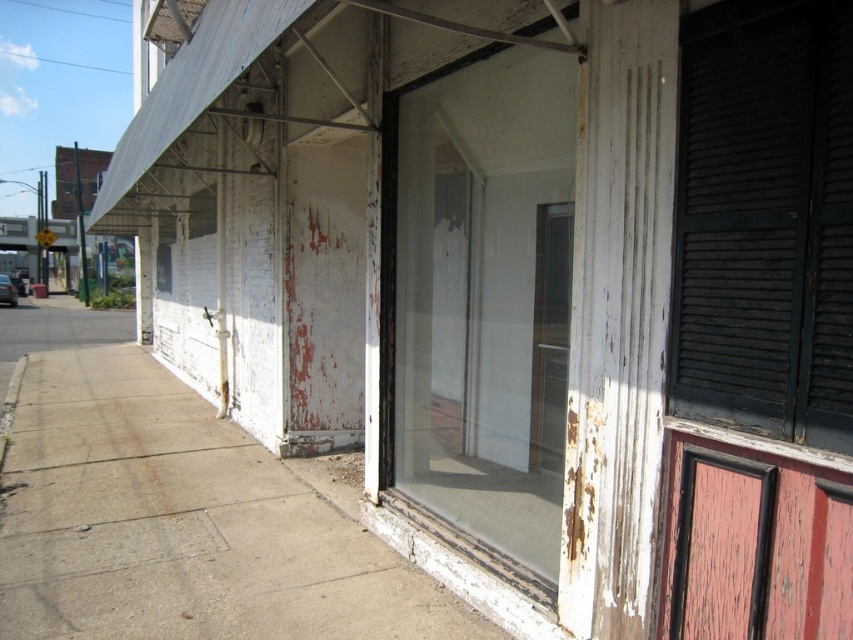
Can you confirm if concrete at center is positioned to the left of transparent glass door at center?

Indeed, concrete at center is positioned on the left side of transparent glass door at center.

Can you confirm if concrete at center is shorter than transparent glass door at center?

Indeed, concrete at center has a lesser height compared to transparent glass door at center.

What are the coordinates of `concrete at center` in the screenshot? It's located at [x=173, y=513].

Between dark gray wooden shutter at right and peeling red wood screen door at lower right, which one has more height?

dark gray wooden shutter at right

Is point (809, 300) farther from viewer compared to point (846, 508)?

Yes.

Where is `dark gray wooden shutter at right`? This screenshot has width=853, height=640. dark gray wooden shutter at right is located at coordinates (764, 220).

Where is `dark gray wooden shutter at right`? dark gray wooden shutter at right is located at coordinates (764, 220).

Is concrete at center shorter than dark gray wooden shutter at right?

Correct, concrete at center is not as tall as dark gray wooden shutter at right.

This screenshot has width=853, height=640. What do you see at coordinates (173, 513) in the screenshot? I see `concrete at center` at bounding box center [173, 513].

The height and width of the screenshot is (640, 853). I want to click on concrete at center, so click(x=173, y=513).